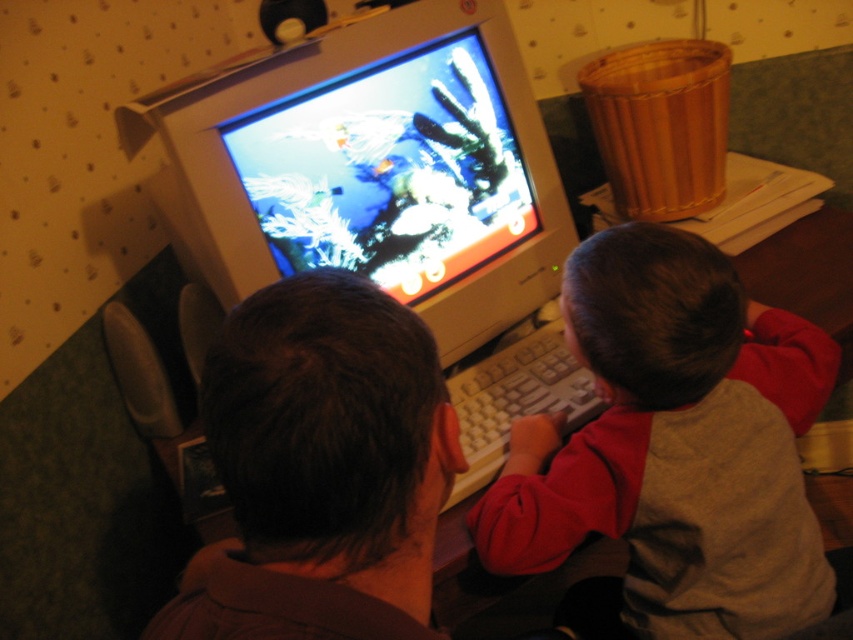
Question: Which of the following is the farthest from the observer?

Choices:
 (A) (473, 65)
 (B) (721, 572)

Answer: (A)

Question: Which point is farther to the camera?

Choices:
 (A) (402, 417)
 (B) (270, 282)

Answer: (B)

Question: Which point is closer to the camera?

Choices:
 (A) gray cotton shirt at center
 (B) shiny plastic monitor at center
 (C) brown matte hair at center

Answer: (C)

Question: Does shiny plastic monitor at center lie in front of gray cotton shirt at center?

Choices:
 (A) yes
 (B) no

Answer: (B)

Question: Considering the relative positions of shiny plastic monitor at center and gray cotton shirt at center in the image provided, where is shiny plastic monitor at center located with respect to gray cotton shirt at center?

Choices:
 (A) right
 (B) left

Answer: (B)

Question: Does shiny plastic monitor at center lie behind gray cotton shirt at center?

Choices:
 (A) no
 (B) yes

Answer: (B)